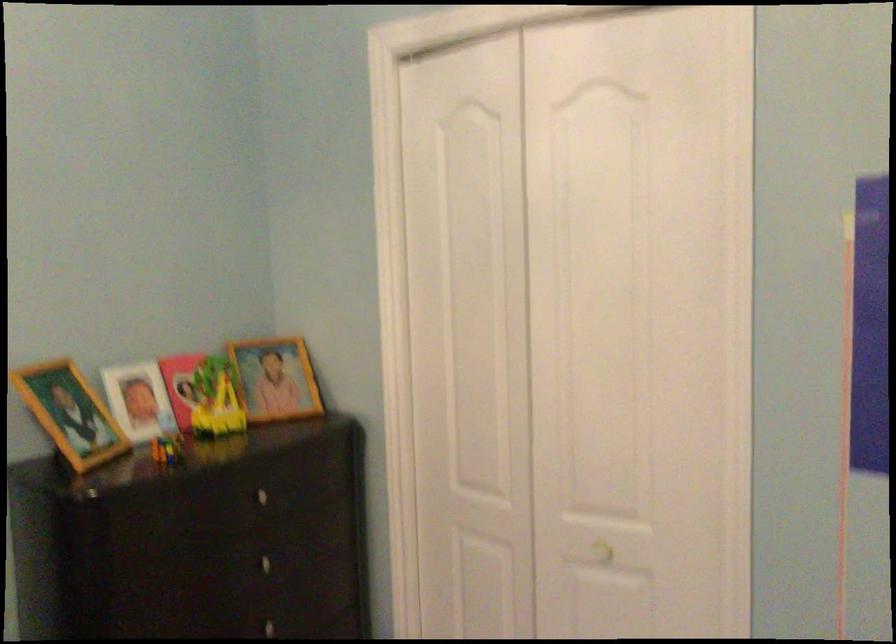
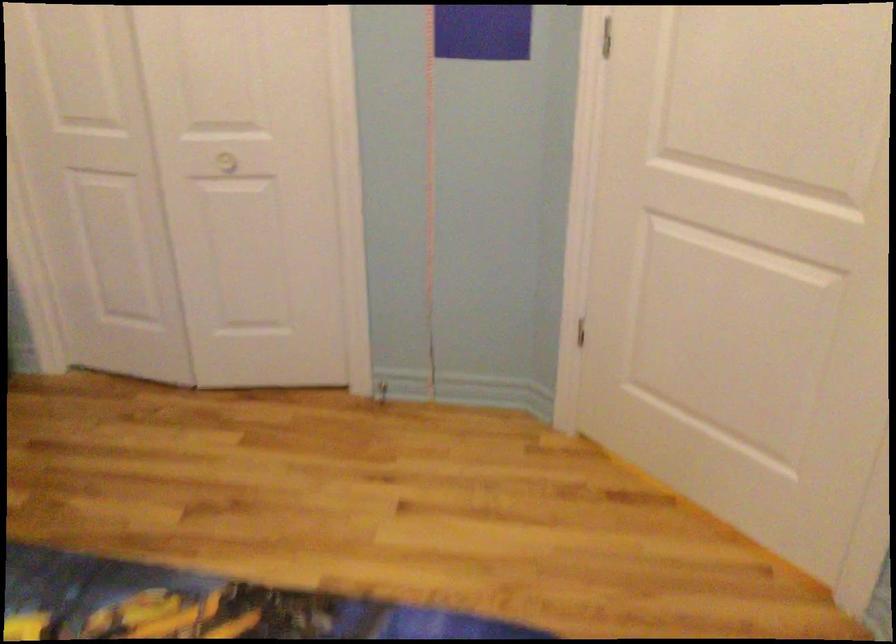
The point at (x=609, y=556) is marked in the first image. Where is the corresponding point in the second image?

(227, 162)